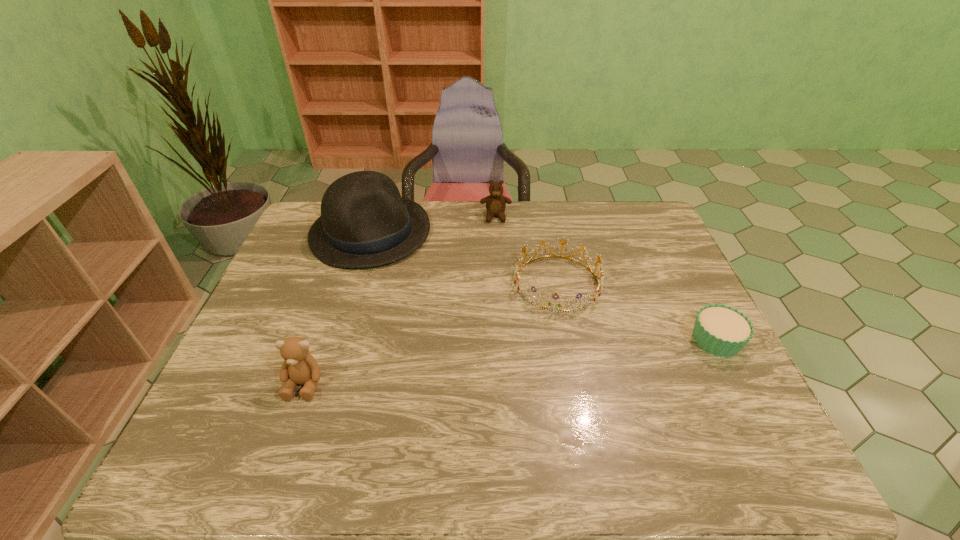
The width and height of the screenshot is (960, 540). What are the coordinates of `object that is at the near edge` in the screenshot? It's located at click(x=299, y=367).

Where is `teddy bear present at the left edge`? This screenshot has height=540, width=960. teddy bear present at the left edge is located at coordinates (299, 367).

Locate an element on the screen. bowler hat at the left edge is located at coordinates pyautogui.click(x=364, y=222).

This screenshot has width=960, height=540. Find the location of `object that is at the right edge`. object that is at the right edge is located at coordinates (720, 330).

Locate an element on the screen. This screenshot has height=540, width=960. object positioned at the far left corner is located at coordinates (364, 222).

Locate an element on the screen. This screenshot has height=540, width=960. object that is at the near left corner is located at coordinates (299, 367).

The height and width of the screenshot is (540, 960). I want to click on vacant space at the far edge, so click(542, 233).

Locate an element on the screen. vacant space at the near edge of the desktop is located at coordinates (490, 409).

This screenshot has width=960, height=540. What are the coordinates of `free space at the left edge` in the screenshot? It's located at (276, 280).

In the image, there is a desktop. Where is `vacant area at the right edge`? The image size is (960, 540). vacant area at the right edge is located at coordinates (705, 382).